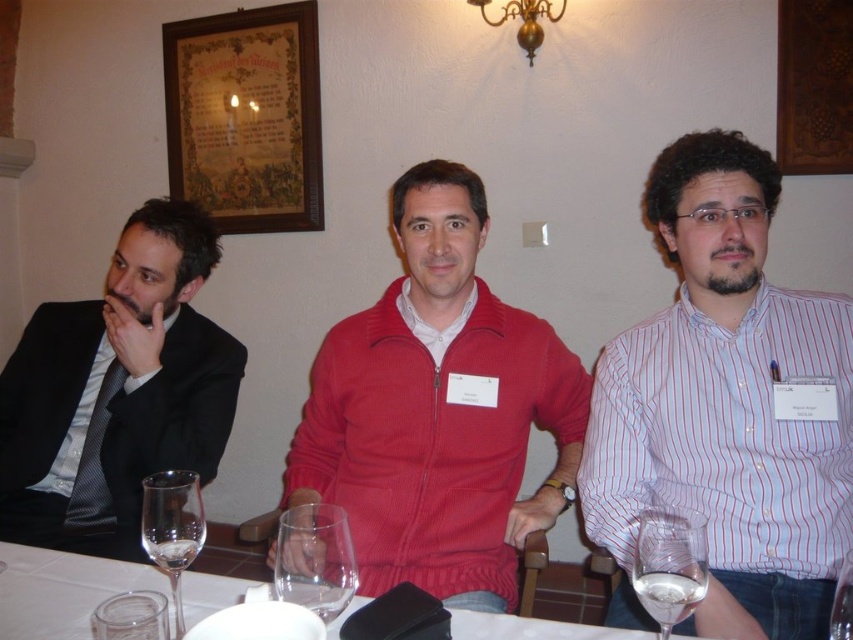
Is point (202, 97) closer to camera compared to point (158, 534)?

No, it is behind (158, 534).

Is point (223, 90) positioned before point (170, 516)?

No, it is not.

Identify the location of wooden frame at upper center. Image resolution: width=853 pixels, height=640 pixels. (247, 116).

Is point (780, 541) in front of point (322, 518)?

No.

Is point (720, 154) farther from camera compared to point (286, 556)?

Yes, point (720, 154) is behind point (286, 556).

Between point (614, 595) and point (334, 560), which one is positioned behind?

Positioned behind is point (614, 595).

The width and height of the screenshot is (853, 640). What are the coordinates of `white striped shirt at center` in the screenshot? It's located at (724, 406).

Between matte black suit at left and wooden frame at upper center, which one is positioned higher?

wooden frame at upper center is above.

Is point (6, 460) farther from viewer compared to point (253, 138)?

No, (6, 460) is closer to viewer.

This screenshot has width=853, height=640. What are the coordinates of `matte black suit at left` in the screenshot? It's located at (117, 390).